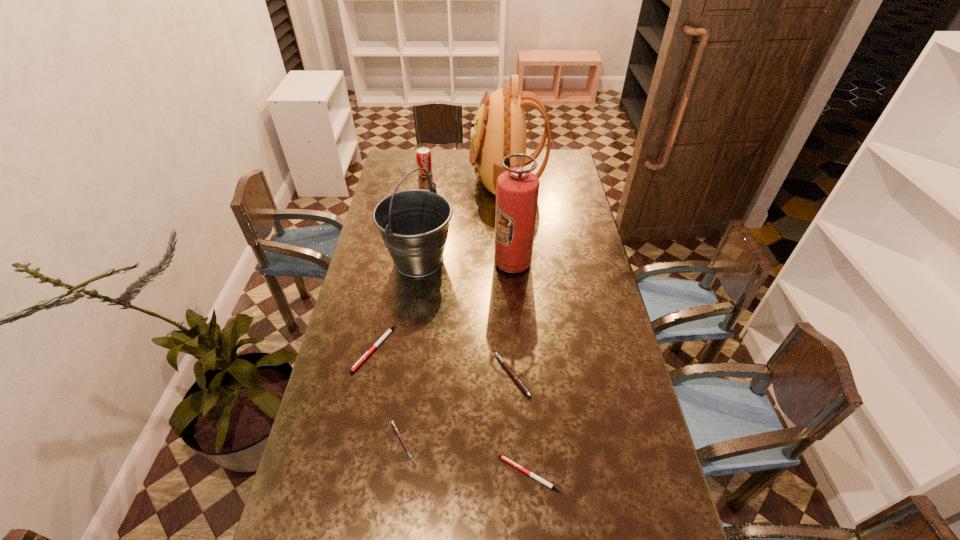
Where is `the nearer pink pen`? The image size is (960, 540). the nearer pink pen is located at coordinates (393, 424).

This screenshot has width=960, height=540. Find the location of `the smaller white pen`. the smaller white pen is located at coordinates (505, 459).

The height and width of the screenshot is (540, 960). I want to click on the nearer white pen, so click(x=505, y=459).

Locate an element on the screen. free space located 0.250m on the front-facing side of the backpack is located at coordinates (418, 178).

Where is `vacant space located 0.130m on the front-facing side of the backpack`? vacant space located 0.130m on the front-facing side of the backpack is located at coordinates (443, 178).

Identify the location of free space located 0.080m on the front-facing side of the backpack. The image size is (960, 540). (453, 178).

Find the location of a particular element. free space located 0.130m on the label side of the fire extinguisher is located at coordinates (461, 263).

Where is `vacant space situated on the label side of the fire extinguisher`? The image size is (960, 540). vacant space situated on the label side of the fire extinguisher is located at coordinates click(x=481, y=263).

This screenshot has width=960, height=540. Identify the location of free space located on the label side of the fire extinguisher. (478, 263).

This screenshot has width=960, height=540. In order to click on free spot located on the front of the gray bucket in this screenshot , I will do `click(405, 355)`.